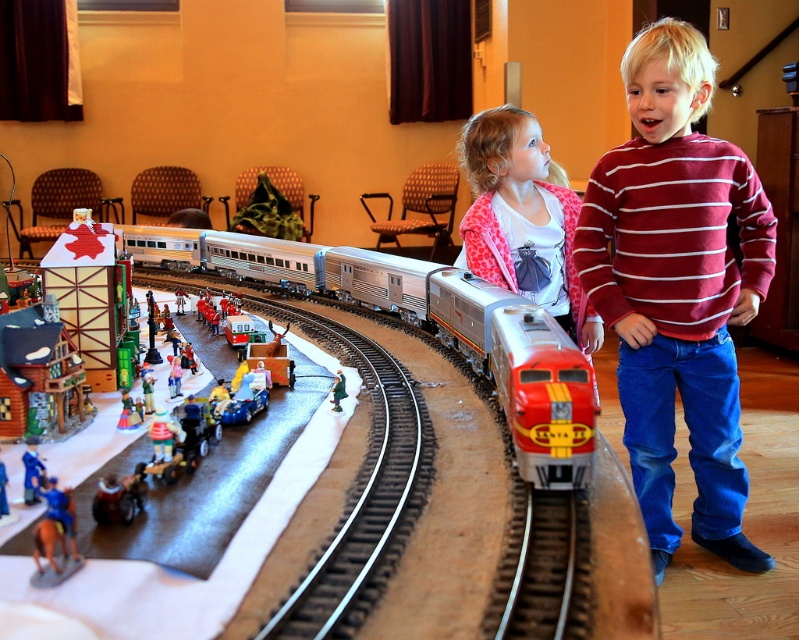
You are trying to place a new toy car between the pink leopard print jacket at center and the wooden house at left. Based on their sizes, will the toy car fit in the space between them?

The pink leopard print jacket at center might be wider than wooden house at left, so there might not be enough space for the toy car to fit between them.

Consider the image. You are a photographer trying to capture a clear photo of the wooden house at left without the pink leopard print jacket at center blocking it. How can you adjust your position to ensure the jacket is out of the frame?

Move your camera position lower so that the pink leopard print jacket at center is no longer above the wooden house at left in the frame.